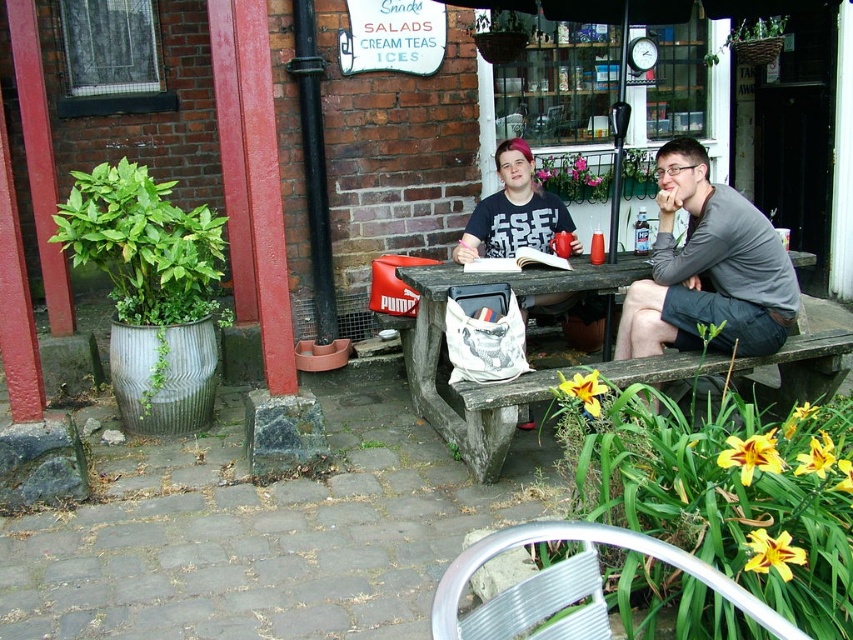
Looking at this image, you are standing at the picnic table and want to place a small plant between the two points labeled point (688, 305) and point (445, 262). Which point should the plant be closer to in order to be positioned in front of both points?

The plant should be closer to point (688, 305) because it is in front of point (445, 262).

You are organizing a small outdoor event and need to ensure there is enough space for both the gray cotton shirt at center and the wooden picnic table at center. Based on the scene, which object takes up more space?

The wooden picnic table at center occupies more space than the gray cotton shirt at center, so it requires more room.